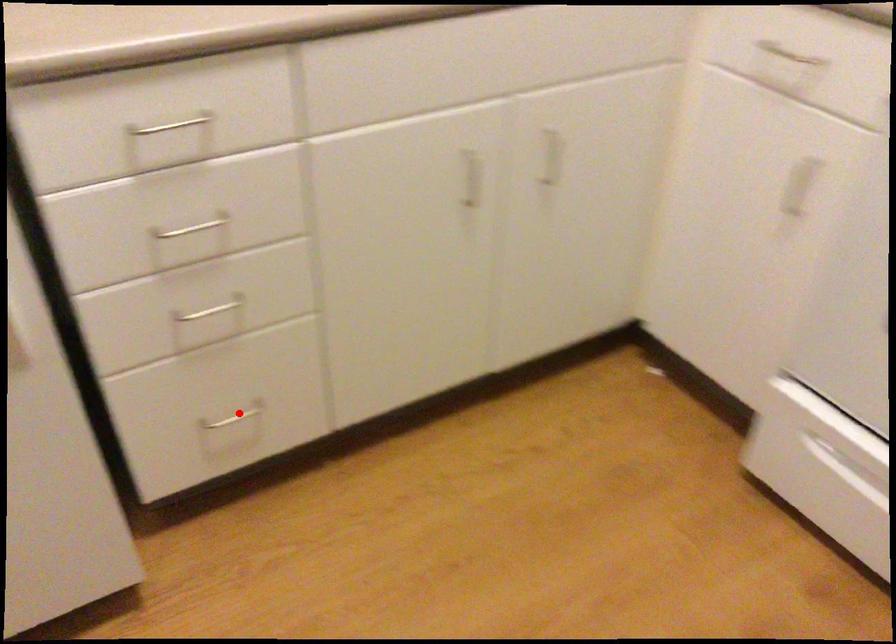
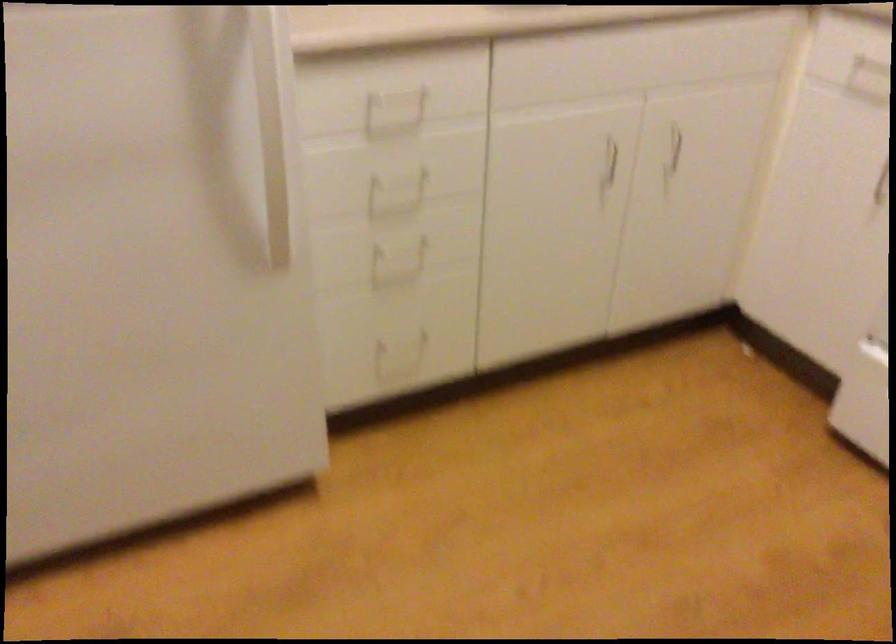
Find the pixel in the second image that matches the highlighted location in the first image.

(401, 345)